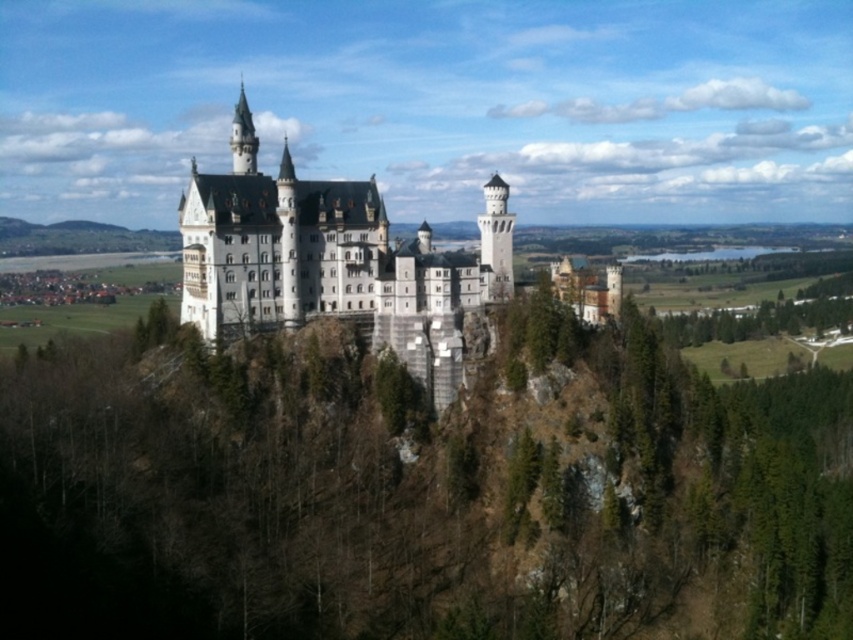
Is green leafy trees at center taller than white stone castle at center?

In fact, green leafy trees at center may be shorter than white stone castle at center.

Measure the distance between point (410, 586) and camera.

Point (410, 586) and camera are 106.06 meters apart from each other.

Locate an element on the screen. The height and width of the screenshot is (640, 853). green leafy trees at center is located at coordinates (416, 493).